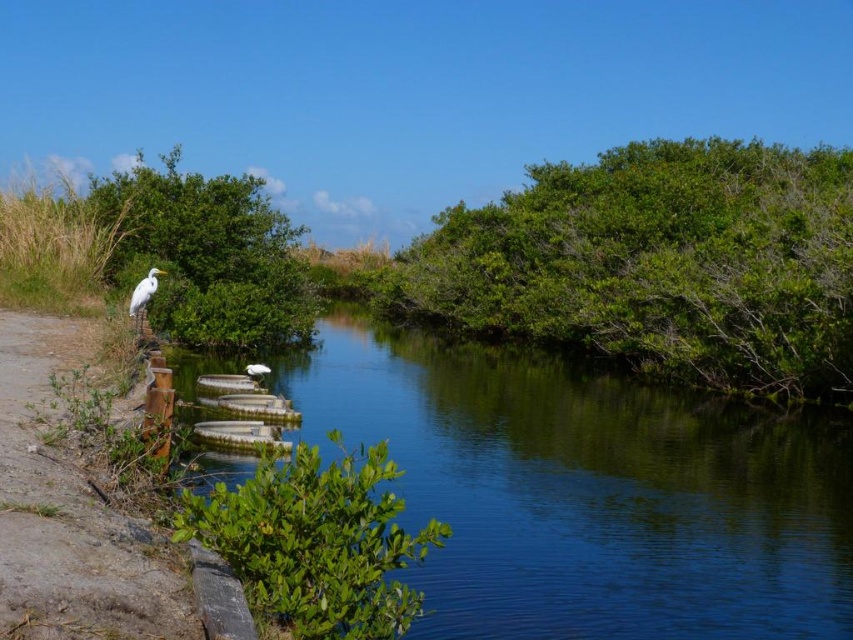
Question: Can you confirm if clear blue water at center is smaller than white matte bird at upper left?

Choices:
 (A) yes
 (B) no

Answer: (B)

Question: Is clear blue water at center above green leafy bush at lower left?

Choices:
 (A) no
 (B) yes

Answer: (A)

Question: Which object is closer to the camera taking this photo?

Choices:
 (A) green leafy bush at upper left
 (B) clear blue water at center
 (C) green leafy bush at lower left
 (D) green leafy bush at upper right

Answer: (C)

Question: Which object is closer to the camera taking this photo?

Choices:
 (A) clear blue water at center
 (B) green leafy bush at lower left
 (C) green leafy bush at upper left
 (D) green leafy bush at upper right

Answer: (B)

Question: Which of these objects is positioned closest to the green leafy bush at upper left?

Choices:
 (A) white matte bird at upper left
 (B) clear blue water at center
 (C) green leafy bush at lower left
 (D) green leafy bush at upper right

Answer: (B)

Question: Can you confirm if green leafy bush at upper right is wider than green leafy bush at upper left?

Choices:
 (A) no
 (B) yes

Answer: (A)